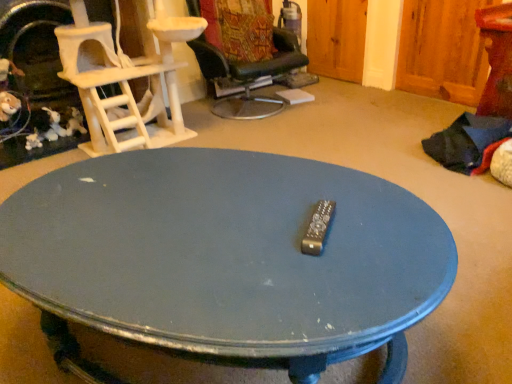
The width and height of the screenshot is (512, 384). In order to click on blue painted wood coffee table at center in this screenshot , I will do `click(229, 256)`.

What do you see at coordinates (121, 82) in the screenshot? Image resolution: width=512 pixels, height=384 pixels. I see `white textured cat tree at left, positioned as the first chair in left-to-right order` at bounding box center [121, 82].

Where is `blue painted wood coffee table at center`? blue painted wood coffee table at center is located at coordinates (229, 256).

Where is `coffee table on the right side of white textured cat tree at left, positioned as the first chair in left-to-right order`? The image size is (512, 384). coffee table on the right side of white textured cat tree at left, positioned as the first chair in left-to-right order is located at coordinates (229, 256).

Between white textured cat tree at left, positioned as the first chair in left-to-right order, and blue painted wood coffee table at center, which one has smaller size?

Smaller between the two is blue painted wood coffee table at center.

From the image's perspective, is white textured cat tree at left, positioned as the first chair in left-to-right order, located above or below blue painted wood coffee table at center?

Based on their image positions, white textured cat tree at left, positioned as the first chair in left-to-right order, is located above blue painted wood coffee table at center.

Does white textured cat tree at left, arranged as the second chair when viewed from the right, have a lesser width compared to blue painted wood coffee table at center?

Correct, the width of white textured cat tree at left, arranged as the second chair when viewed from the right, is less than that of blue painted wood coffee table at center.

Which of these two, black leather chair at upper center, which ranks as the second chair in left-to-right order, or white textured cat tree at left, positioned as the first chair in left-to-right order, is wider?

black leather chair at upper center, which ranks as the second chair in left-to-right order.

Could you measure the distance between black leather chair at upper center, acting as the 1th chair starting from the right, and white textured cat tree at left, arranged as the second chair when viewed from the right?

They are 25.75 inches apart.

Considering the positions of objects black leather chair at upper center, acting as the 1th chair starting from the right, and white textured cat tree at left, positioned as the first chair in left-to-right order, in the image provided, who is more to the right, black leather chair at upper center, acting as the 1th chair starting from the right, or white textured cat tree at left, positioned as the first chair in left-to-right order,?

From the viewer's perspective, black leather chair at upper center, acting as the 1th chair starting from the right, appears more on the right side.

Based on the photo, is black leather chair at upper center, acting as the 1th chair starting from the right, far from white textured cat tree at left, positioned as the first chair in left-to-right order?

black leather chair at upper center, acting as the 1th chair starting from the right, is near white textured cat tree at left, positioned as the first chair in left-to-right order, not far away.

In the scene shown: Is black leather chair at upper center, which ranks as the second chair in left-to-right order, oriented towards blue painted wood coffee table at center?

No, black leather chair at upper center, which ranks as the second chair in left-to-right order, is not oriented towards blue painted wood coffee table at center.

Which is less distant, (249, 76) or (97, 306)?

Clearly, point (249, 76) is more distant from the camera than point (97, 306).

Based on the photo, from a real-world perspective, which object stands above the other?

In real-world perspective, black leather chair at upper center, acting as the 1th chair starting from the right, is above.

Which is more to the left, blue painted wood coffee table at center or black leather chair at upper center, which ranks as the second chair in left-to-right order?

blue painted wood coffee table at center is more to the left.

Would you say black leather chair at upper center, which ranks as the second chair in left-to-right order, is part of blue painted wood coffee table at center's contents?

Actually, black leather chair at upper center, which ranks as the second chair in left-to-right order, is outside blue painted wood coffee table at center.

In terms of height, does white textured cat tree at left, positioned as the first chair in left-to-right order, look taller or shorter compared to black leather chair at upper center, acting as the 1th chair starting from the right?

Clearly, white textured cat tree at left, positioned as the first chair in left-to-right order, is taller compared to black leather chair at upper center, acting as the 1th chair starting from the right.

Is white textured cat tree at left, positioned as the first chair in left-to-right order, to the right of black leather chair at upper center, which ranks as the second chair in left-to-right order, from the viewer's perspective?

No, white textured cat tree at left, positioned as the first chair in left-to-right order, is not to the right of black leather chair at upper center, which ranks as the second chair in left-to-right order.

Between white textured cat tree at left, positioned as the first chair in left-to-right order, and black leather chair at upper center, acting as the 1th chair starting from the right, which one has smaller width?

With smaller width is white textured cat tree at left, positioned as the first chair in left-to-right order.

Which is correct: white textured cat tree at left, positioned as the first chair in left-to-right order, is inside black leather chair at upper center, acting as the 1th chair starting from the right, or outside of it?

white textured cat tree at left, positioned as the first chair in left-to-right order, cannot be found inside black leather chair at upper center, acting as the 1th chair starting from the right.

Considering the relative sizes of blue painted wood coffee table at center and white textured cat tree at left, positioned as the first chair in left-to-right order, in the image provided, is blue painted wood coffee table at center thinner than white textured cat tree at left, positioned as the first chair in left-to-right order,?

Incorrect, the width of blue painted wood coffee table at center is not less than that of white textured cat tree at left, positioned as the first chair in left-to-right order.

From a real-world perspective, relative to white textured cat tree at left, positioned as the first chair in left-to-right order, is blue painted wood coffee table at center vertically above or below?

From a real-world perspective, blue painted wood coffee table at center is physically below white textured cat tree at left, positioned as the first chair in left-to-right order.

From the image's perspective, between blue painted wood coffee table at center and white textured cat tree at left, arranged as the second chair when viewed from the right, who is located below?

blue painted wood coffee table at center appears lower in the image.

This screenshot has width=512, height=384. I want to click on the 1st chair behind the blue painted wood coffee table at center, so click(x=121, y=82).

There is a blue painted wood coffee table at center. Where is `the 1st chair above it (from the image's perspective)`? The width and height of the screenshot is (512, 384). the 1st chair above it (from the image's perspective) is located at coordinates (121, 82).

Identify the location of chair in front of the black leather chair at upper center, which ranks as the second chair in left-to-right order. This screenshot has width=512, height=384. (121, 82).

From the image, which object appears to be nearer to blue painted wood coffee table at center, white textured cat tree at left, positioned as the first chair in left-to-right order, or black leather chair at upper center, which ranks as the second chair in left-to-right order?

white textured cat tree at left, positioned as the first chair in left-to-right order, lies closer to blue painted wood coffee table at center than the other object.

From the image, which object appears to be nearer to blue painted wood coffee table at center, black leather chair at upper center, which ranks as the second chair in left-to-right order, or white textured cat tree at left, positioned as the first chair in left-to-right order?

white textured cat tree at left, positioned as the first chair in left-to-right order, is positioned closer to the anchor blue painted wood coffee table at center.

Based on the photo, which object lies further to the anchor point white textured cat tree at left, arranged as the second chair when viewed from the right, black leather chair at upper center, acting as the 1th chair starting from the right, or blue painted wood coffee table at center?

blue painted wood coffee table at center.

Based on their spatial positions, is white textured cat tree at left, positioned as the first chair in left-to-right order, or blue painted wood coffee table at center further from black leather chair at upper center, acting as the 1th chair starting from the right?

The object further to black leather chair at upper center, acting as the 1th chair starting from the right, is blue painted wood coffee table at center.

Considering their positions, is blue painted wood coffee table at center positioned further to black leather chair at upper center, which ranks as the second chair in left-to-right order, than white textured cat tree at left, arranged as the second chair when viewed from the right?

Based on the image, blue painted wood coffee table at center appears to be further to black leather chair at upper center, which ranks as the second chair in left-to-right order.

When comparing their distances from white textured cat tree at left, positioned as the first chair in left-to-right order, does blue painted wood coffee table at center or black leather chair at upper center, which ranks as the second chair in left-to-right order, seem further?

Among the two, blue painted wood coffee table at center is located further to white textured cat tree at left, positioned as the first chair in left-to-right order.

Identify the location of chair positioned between blue painted wood coffee table at center and black leather chair at upper center, acting as the 1th chair starting from the right, from near to far. This screenshot has width=512, height=384. (121, 82).